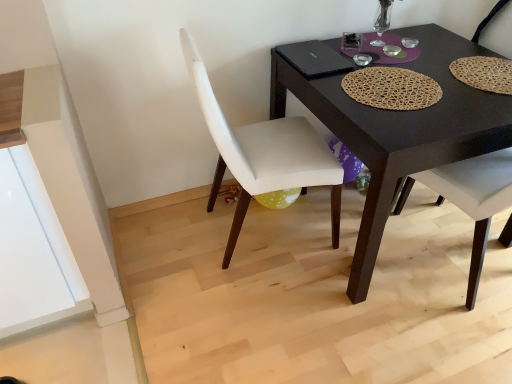
I want to click on vacant area that is in front of black matte laptop at upper center, so click(348, 82).